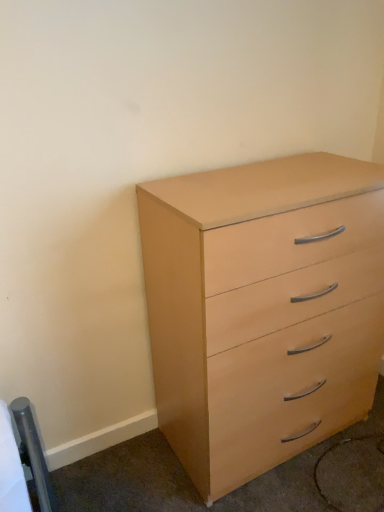
Describe the element at coordinates (262, 309) in the screenshot. I see `light wood chest of drawers at right` at that location.

I want to click on light wood chest of drawers at right, so click(262, 309).

This screenshot has height=512, width=384. Find the location of `light wood chest of drawers at right`. light wood chest of drawers at right is located at coordinates (262, 309).